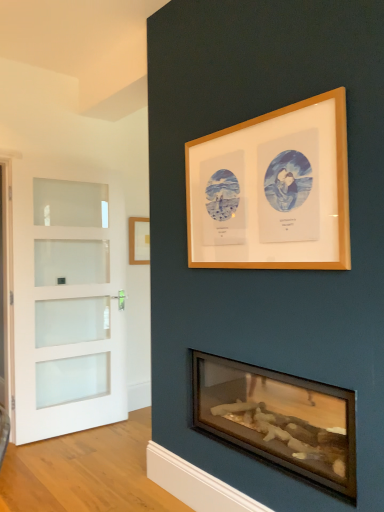
Locate an element on the screen. vacant area on top of wooden picture frame at upper center, the first picture frame when ordered from right to left (from a real-world perspective) is located at coordinates (257, 116).